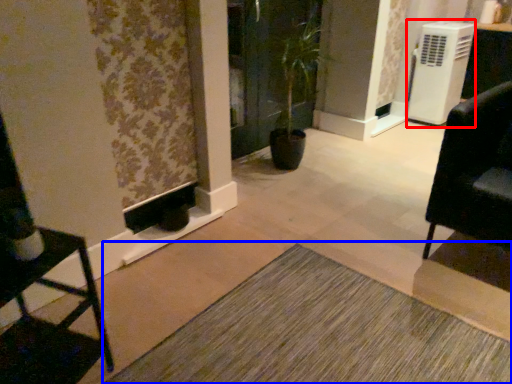
Question: Which object appears farthest to the camera in this image, air conditioning (highlighted by a red box) or doormat (highlighted by a blue box)?

Choices:
 (A) air conditioning
 (B) doormat

Answer: (A)